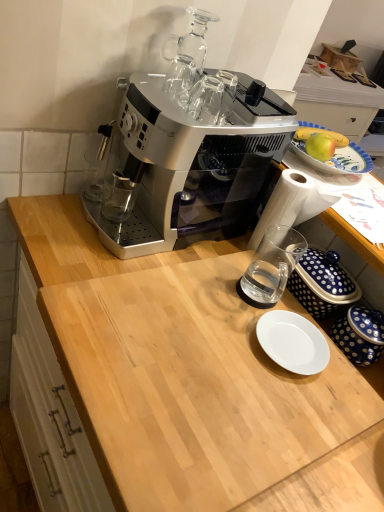
Question: Does satin silver coffee maker at upper center appear on the left side of light wood cutting board at center?

Choices:
 (A) no
 (B) yes

Answer: (B)

Question: Is satin silver coffee maker at upper center outside light wood cutting board at center?

Choices:
 (A) yes
 (B) no

Answer: (A)

Question: Would you consider satin silver coffee maker at upper center to be distant from light wood cutting board at center?

Choices:
 (A) no
 (B) yes

Answer: (A)

Question: Is satin silver coffee maker at upper center with light wood cutting board at center?

Choices:
 (A) yes
 (B) no

Answer: (B)

Question: Does satin silver coffee maker at upper center have a lesser height compared to light wood cutting board at center?

Choices:
 (A) yes
 (B) no

Answer: (B)

Question: Is satin silver coffee maker at upper center looking in the opposite direction of light wood cutting board at center?

Choices:
 (A) yes
 (B) no

Answer: (B)

Question: Can you confirm if light wood cutting board at center is positioned to the right of satin silver coffee maker at upper center?

Choices:
 (A) no
 (B) yes

Answer: (B)

Question: Is satin silver coffee maker at upper center surrounded by light wood cutting board at center?

Choices:
 (A) no
 (B) yes

Answer: (A)

Question: Can you confirm if light wood cutting board at center is thinner than satin silver coffee maker at upper center?

Choices:
 (A) no
 (B) yes

Answer: (A)

Question: From the image's perspective, is light wood cutting board at center over satin silver coffee maker at upper center?

Choices:
 (A) no
 (B) yes

Answer: (A)

Question: Are light wood cutting board at center and satin silver coffee maker at upper center far apart?

Choices:
 (A) yes
 (B) no

Answer: (B)

Question: From a real-world perspective, is light wood cutting board at center physically below satin silver coffee maker at upper center?

Choices:
 (A) no
 (B) yes

Answer: (B)

Question: Is blue dotted ceramic jar at lower right wider than white glossy plate at center?

Choices:
 (A) yes
 (B) no

Answer: (B)